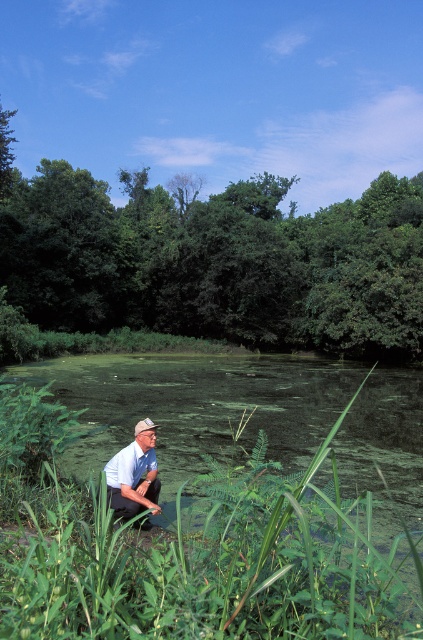
Question: From the image, what is the correct spatial relationship of green leafy tree at center in relation to light blue shirt at lower center?

Choices:
 (A) left
 (B) right

Answer: (B)

Question: Is green leafy tree at center thinner than light blue shirt at lower center?

Choices:
 (A) yes
 (B) no

Answer: (B)

Question: Is green leafy tree at center further to camera compared to light blue shirt at lower center?

Choices:
 (A) no
 (B) yes

Answer: (B)

Question: Which point is farther to the camera?

Choices:
 (A) green leafy tree at center
 (B) light blue shirt at lower center

Answer: (A)

Question: Which object appears closest to the camera in this image?

Choices:
 (A) light blue shirt at lower center
 (B) green leafy tree at center

Answer: (A)